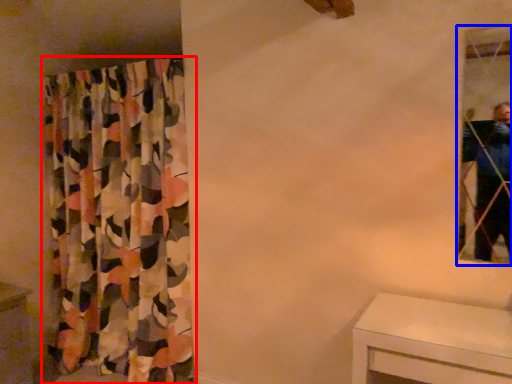
Question: Which object is further to the camera taking this photo, curtain (highlighted by a red box) or mirror (highlighted by a blue box)?

Choices:
 (A) curtain
 (B) mirror

Answer: (A)